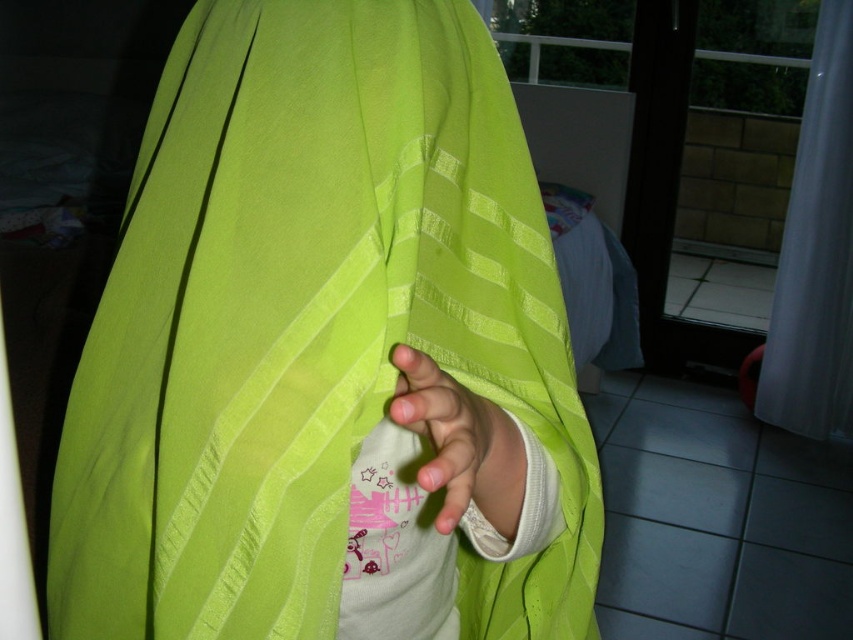
Question: Estimate the real-world distances between objects in this image. Which object is closer to the matte green fabric at lower center?

Choices:
 (A) lime green fabric at center
 (B) white sheer curtain at right

Answer: (A)

Question: Among these objects, which one is nearest to the camera?

Choices:
 (A) white sheer curtain at right
 (B) matte green fabric at lower center

Answer: (B)

Question: Does lime green fabric at center appear over matte green fabric at lower center?

Choices:
 (A) no
 (B) yes

Answer: (A)

Question: Is lime green fabric at center wider than white sheer curtain at right?

Choices:
 (A) no
 (B) yes

Answer: (B)

Question: Which of the following is the farthest from the observer?

Choices:
 (A) matte green fabric at lower center
 (B) lime green fabric at center

Answer: (B)

Question: Is lime green fabric at center closer to camera compared to white sheer curtain at right?

Choices:
 (A) no
 (B) yes

Answer: (B)